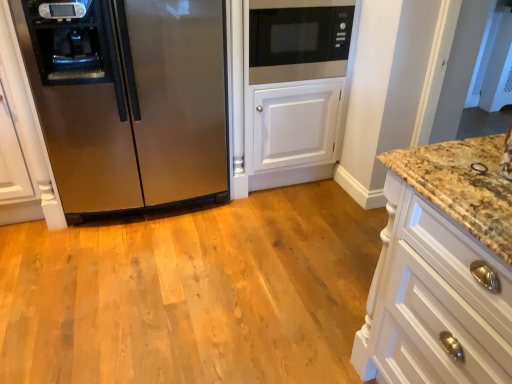
Question: From their relative heights in the image, would you say stainless steel refrigerator at left is taller or shorter than black matte microwave at upper center?

Choices:
 (A) tall
 (B) short

Answer: (A)

Question: From the image's perspective, is stainless steel refrigerator at left located above or below black matte microwave at upper center?

Choices:
 (A) below
 (B) above

Answer: (A)

Question: Which of these objects is positioned closest to the black matte microwave at upper center?

Choices:
 (A) stainless steel refrigerator at left
 (B) white wood cabinet at right

Answer: (A)

Question: Estimate the real-world distances between objects in this image. Which object is farther from the black matte microwave at upper center?

Choices:
 (A) stainless steel refrigerator at left
 (B) white wood cabinet at right

Answer: (B)